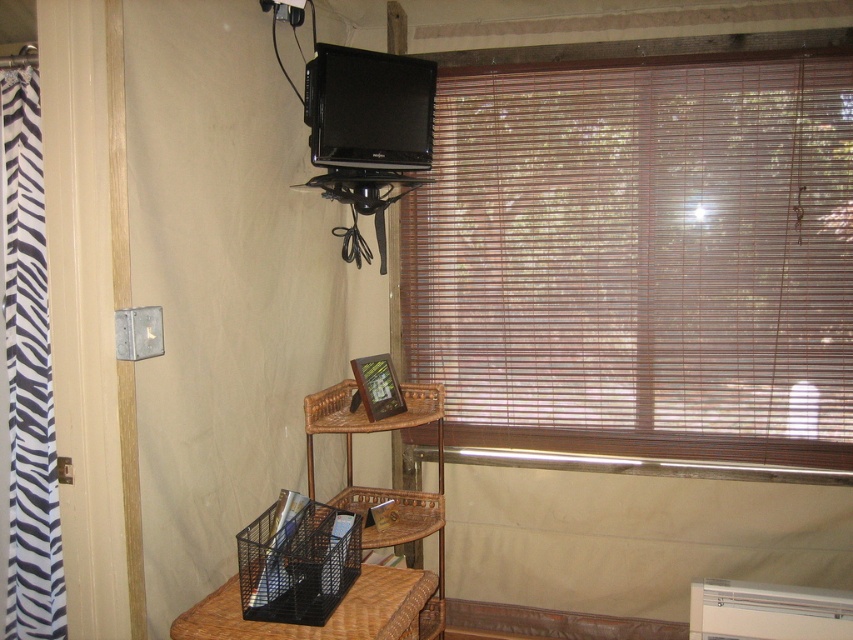
Question: Where is black glossy tv at upper center located in relation to white plastic air conditioner at lower right in the image?

Choices:
 (A) left
 (B) right

Answer: (A)

Question: Does black mesh basket at lower center have a larger size compared to white plastic air conditioner at lower right?

Choices:
 (A) no
 (B) yes

Answer: (B)

Question: Which object is closer to the camera taking this photo?

Choices:
 (A) white plastic air conditioner at lower right
 (B) woven wood shelf at lower center
 (C) brown wood blinds at upper right
 (D) black mesh basket at lower center

Answer: (D)

Question: Among these points, which one is nearest to the camera?

Choices:
 (A) (830, 612)
 (B) (410, 572)
 (C) (7, 92)
 (D) (405, 112)

Answer: (B)

Question: Which is farther from the zebra print fabric at left?

Choices:
 (A) black mesh basket at lower center
 (B) black glossy tv at upper center
 (C) brown wood blinds at upper right

Answer: (C)

Question: Considering the relative positions of brown wood blinds at upper right and woven wood shelf at lower center in the image provided, where is brown wood blinds at upper right located with respect to woven wood shelf at lower center?

Choices:
 (A) right
 (B) left

Answer: (A)